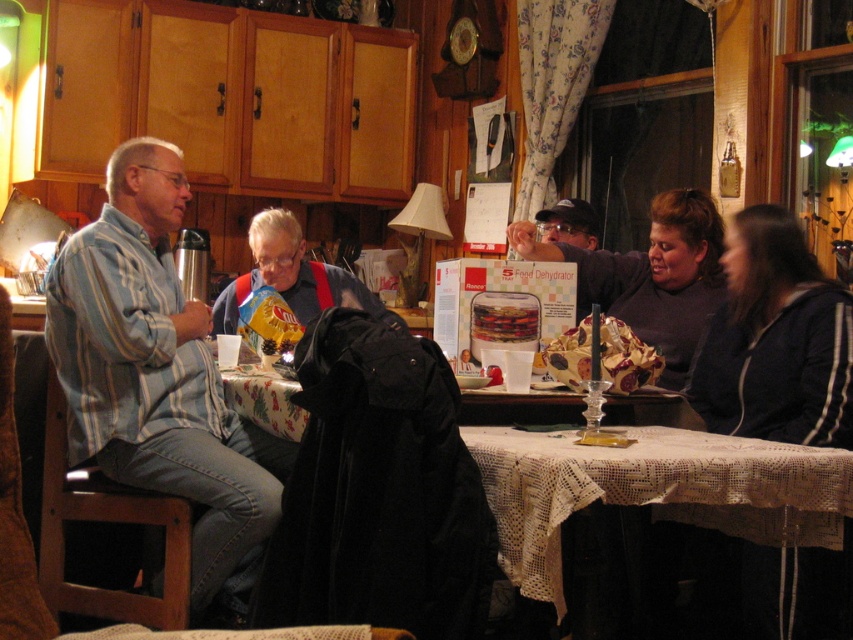
You are organizing a clothing donation drive and need to categorize items by size. You have a striped cotton shirt at left and a denim jacket at center. Which item is bigger in size?

The striped cotton shirt at left is larger in size compared to the denim jacket at center, so it should be categorized accordingly.

Based on the photo, in the image, where is the striped cotton shirt at left located in terms of its 2D coordinates?

The striped cotton shirt at left is located at the 2D coordinates of point (158, 376).